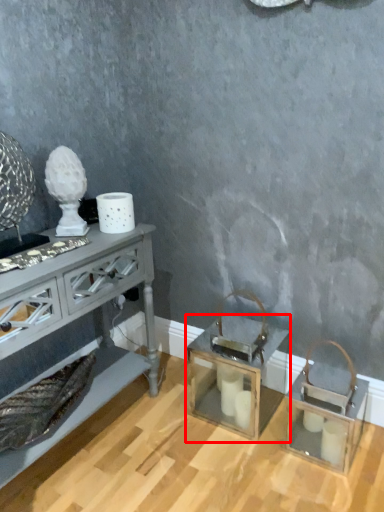
Question: In this image, where is table (annotated by the red box) located relative to table?

Choices:
 (A) right
 (B) left

Answer: (A)